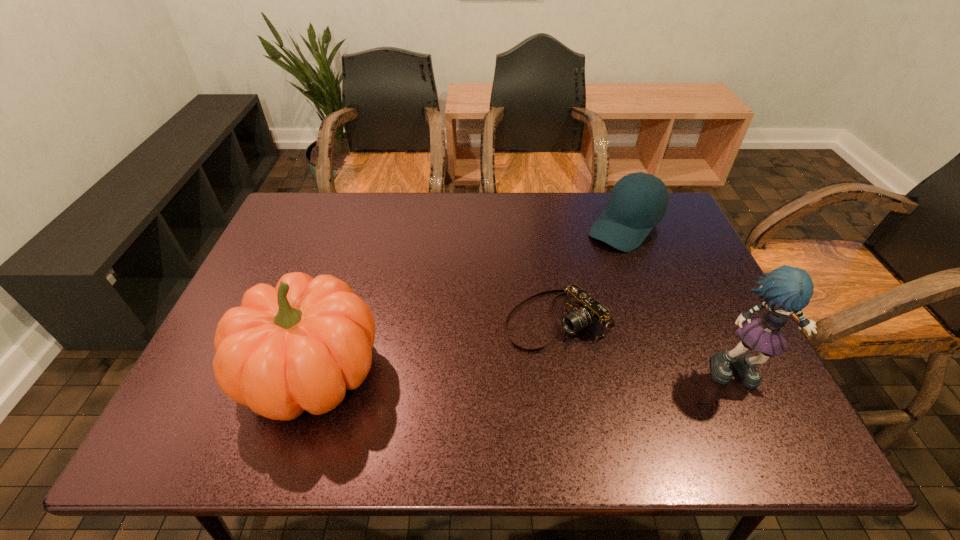
The height and width of the screenshot is (540, 960). I want to click on object situated at the far right corner, so click(638, 201).

This screenshot has height=540, width=960. In order to click on object situated at the near right corner in this screenshot , I will do `click(786, 290)`.

At what (x,y) coordinates should I click in order to perform the action: click on blank space at the far edge of the desktop. Please return your answer as a coordinate pair (x, y). The image size is (960, 540). Looking at the image, I should click on (x=500, y=222).

Locate an element on the screen. Image resolution: width=960 pixels, height=540 pixels. free space at the left edge of the desktop is located at coordinates (281, 272).

The height and width of the screenshot is (540, 960). What are the coordinates of `free spot at the right edge of the desktop` in the screenshot? It's located at (648, 276).

The image size is (960, 540). In the image, there is a desktop. In order to click on free region at the far left corner in this screenshot , I will do `click(300, 207)`.

Image resolution: width=960 pixels, height=540 pixels. I want to click on free spot between the pumpkin and the farthest object, so click(x=468, y=300).

Find the location of a particular element. The width and height of the screenshot is (960, 540). free space between the third tallest object and the rag doll is located at coordinates (684, 299).

Find the location of a particular element. The image size is (960, 540). vacant area between the pumpkin and the second shortest object is located at coordinates (468, 300).

Identify the location of blank region between the camera and the pumpkin. (434, 346).